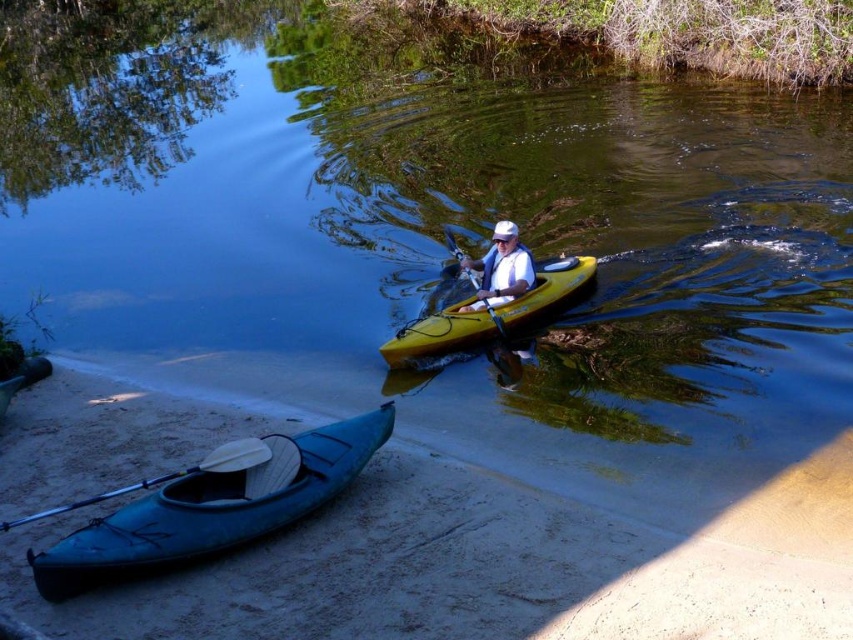
Looking at this image, you are planning to store the teal plastic canoe at lower left and the white foam paddle at lower left in a storage container. The container has a width of 1 meter. Can both items fit side by side within the container?

The teal plastic canoe at lower left might be wider than white foam paddle at lower left. Since the container is only 1 meter wide, it is uncertain if both can fit without overlapping. Check the exact width of the canoe to confirm.

You are standing on the sandy shore at lower left and want to reach the teal plastic canoe at lower left. Which direction should you move to get closer to the canoe?

The sandy shore at lower left is located below the teal plastic canoe at lower left, so you should move upward from the sandy shore at lower left to reach the teal plastic canoe at lower left.

You are standing at the point labeled as point (341,486) and want to reach the point labeled as point (103,621). Which direction should you move relative to your current position?

You should move forward because point (103,621) is in front of point (341,486).